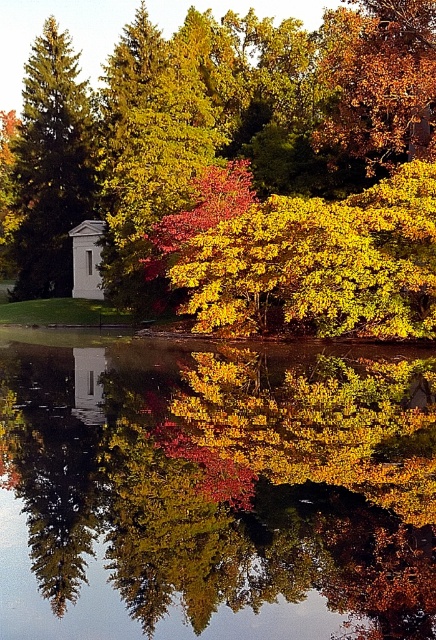
What are the coordinates of `transparent glass lake at center` in the screenshot? It's located at (214, 488).

Is white glossy stone at center bigger than green matte tree at left?

No.

Between point (33, 422) and point (38, 48), which one is positioned in front?

Point (33, 422) is more forward.

You are a GUI agent. You are given a task and a screenshot of the screen. Output one action in this format:
    pyautogui.click(x=<x>, y=<y>)
    Task: Click on the white glossy stone at center
    
    Given the screenshot: What is the action you would take?
    tap(54, 458)

Between point (6, 472) and point (340, 36), which one is positioned in front?

Point (6, 472)

Consider the image. Which is below, white glossy stone at center or golden textured leaves at upper right?

white glossy stone at center

Image resolution: width=436 pixels, height=640 pixels. Identify the location of white glossy stone at center. (54, 458).

I want to click on white glossy stone at center, so click(54, 458).